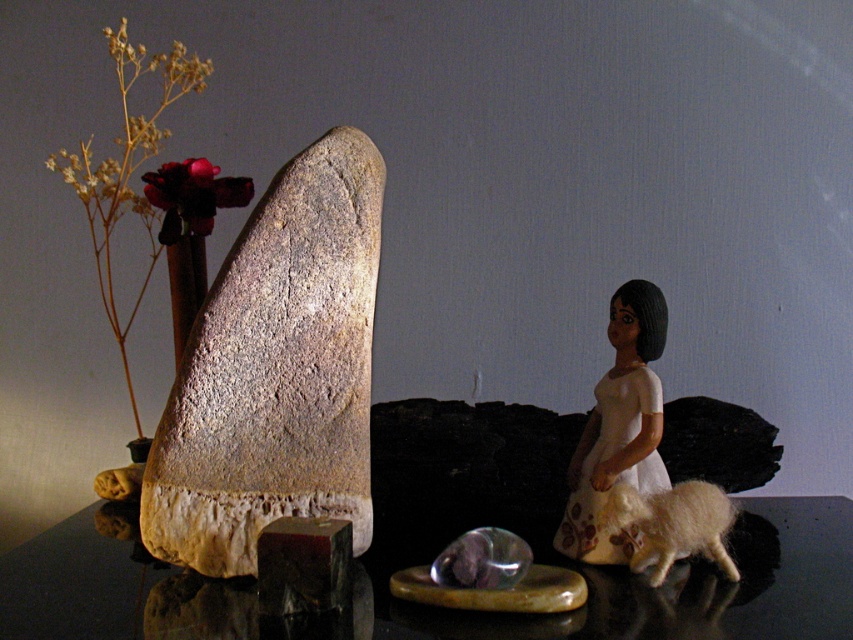
Is the position of white matte dress at center right less distant than that of white woolen lamb at lower right?

No, it is not.

Consider the image. Which is below, white matte dress at center right or white woolen lamb at lower right?

white woolen lamb at lower right

Which is behind, point (587, 536) or point (697, 528)?

Positioned behind is point (587, 536).

Find the location of `white matte dress at center right`. white matte dress at center right is located at coordinates (618, 428).

Is white woolen lamb at lower right thinner than velvety crimson bloom at upper left?

Incorrect, white woolen lamb at lower right's width is not less than velvety crimson bloom at upper left's.

Between point (688, 522) and point (181, 179), which one is positioned behind?

The point (181, 179) is more distant.

Between point (718, 499) and point (189, 225), which one is positioned in front?

Point (718, 499) is more forward.

The image size is (853, 640). I want to click on white woolen lamb at lower right, so click(x=672, y=524).

Locate an element on the screen. black glossy table at center is located at coordinates (665, 588).

Between black glossy table at center and white matte dress at center right, which one appears on the right side from the viewer's perspective?

white matte dress at center right is more to the right.

This screenshot has height=640, width=853. Find the location of `black glossy table at center`. black glossy table at center is located at coordinates (665, 588).